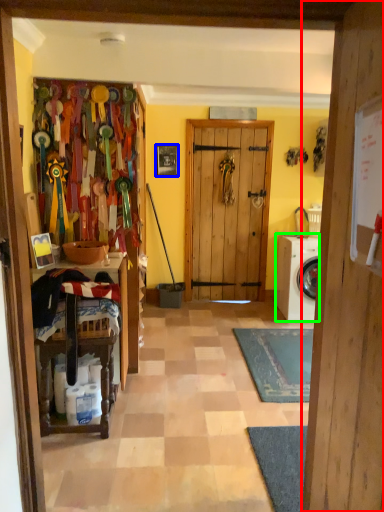
Question: Estimate the real-world distances between objects in this image. Which object is closer to door (highlighted by a red box), picture frame (highlighted by a blue box) or washing machine (highlighted by a green box)?

Choices:
 (A) picture frame
 (B) washing machine

Answer: (B)